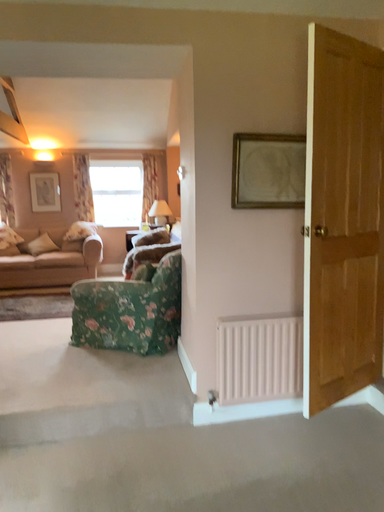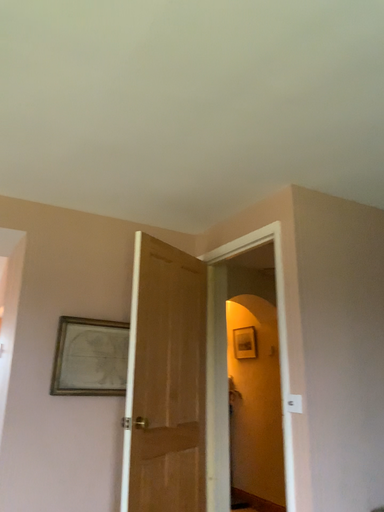
Question: How did the camera likely rotate when shooting the video?

Choices:
 (A) rotated left
 (B) rotated right

Answer: (B)